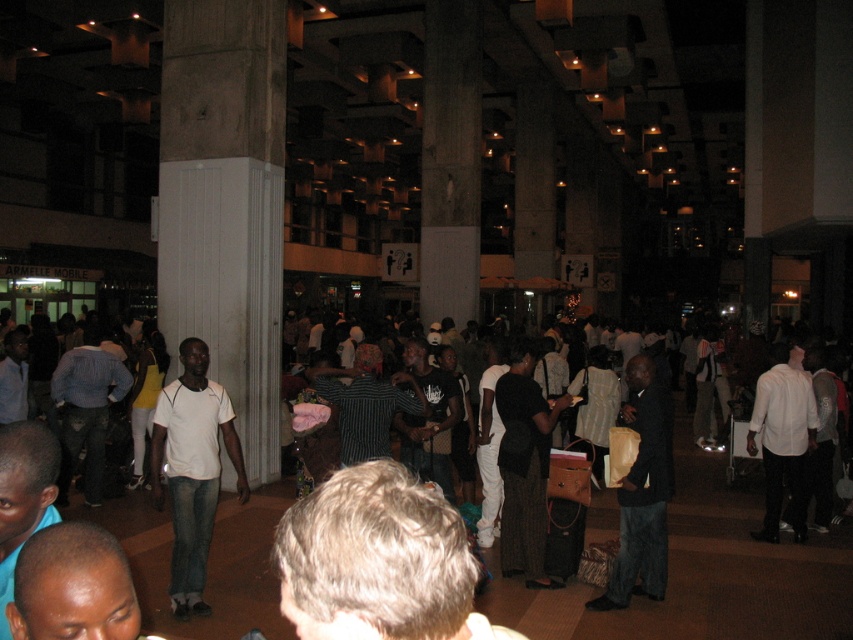
Question: Which point is farther to the camera?

Choices:
 (A) dark brown leather jacket at center
 (B) white shirt at right
 (C) white matte t-shirt at center

Answer: (B)

Question: Is white matte t-shirt at center positioned before white shirt at right?

Choices:
 (A) yes
 (B) no

Answer: (A)

Question: From the image, what is the correct spatial relationship of white matte t-shirt at center in relation to dark brown leather jacket at center?

Choices:
 (A) left
 (B) right

Answer: (A)

Question: Is dark brown leather jacket at center bigger than white shirt at right?

Choices:
 (A) yes
 (B) no

Answer: (A)

Question: Which point is closer to the camera taking this photo?

Choices:
 (A) (177, 528)
 (B) (640, 410)
 (C) (799, 449)

Answer: (A)

Question: Which object is the closest to the dark brown leather jacket at center?

Choices:
 (A) white matte t-shirt at center
 (B) white shirt at right

Answer: (B)